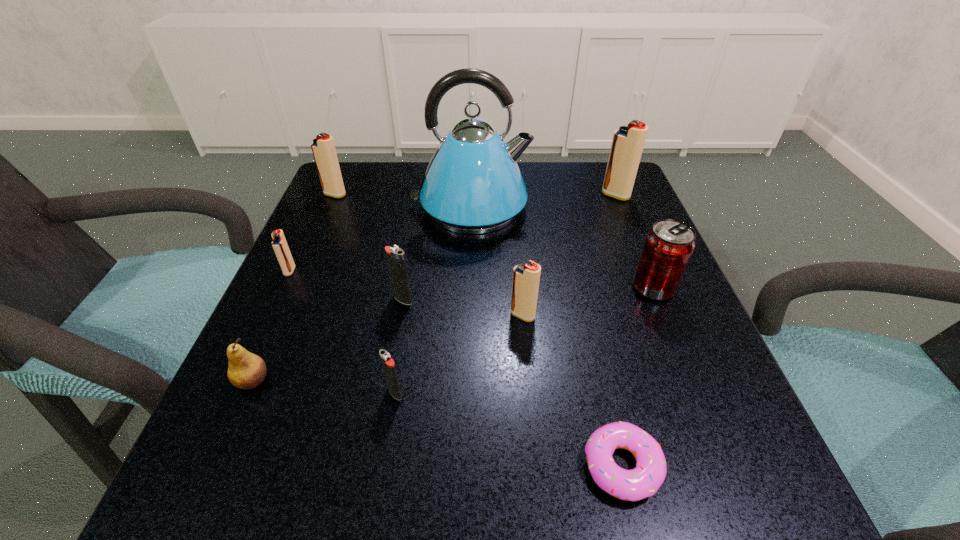
This screenshot has height=540, width=960. What are the coordinates of `vacant space located on the right of the third nearest igniter` in the screenshot? It's located at (604, 299).

The height and width of the screenshot is (540, 960). Find the location of `vacant region located 0.050m on the front of the fourth nearest object`. vacant region located 0.050m on the front of the fourth nearest object is located at coordinates (526, 347).

Identify the location of free spot located 0.050m on the front of the pear. (233, 427).

Where is `free space located on the right of the second nearest red igniter`? free space located on the right of the second nearest red igniter is located at coordinates (464, 271).

Locate an element on the screen. vacant position located 0.280m on the back of the smaller black igniter is located at coordinates click(416, 261).

At what (x,y) coordinates should I click in order to perform the action: click on blank space located on the back of the eighth object from left to right. Please return your answer as a coordinate pair (x, y). The width and height of the screenshot is (960, 540). Looking at the image, I should click on (x=595, y=353).

Image resolution: width=960 pixels, height=540 pixels. I want to click on kettle at the far edge, so click(x=473, y=185).

This screenshot has height=540, width=960. Find the location of `object positioned at the near edge`. object positioned at the near edge is located at coordinates (636, 484).

Identify the location of pear present at the left edge. This screenshot has width=960, height=540. (246, 370).

Find the location of `igniter that is at the right edge`. igniter that is at the right edge is located at coordinates (627, 145).